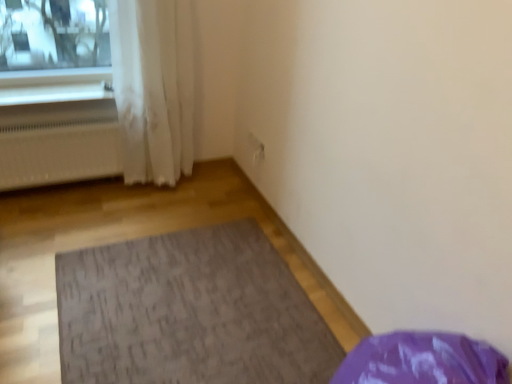
At what (x,y) coordinates should I click in order to perform the action: click on free space below textured gray mat at center (from a real-world perspective). Please return your answer as a coordinate pair (x, y). The image size is (512, 384). Looking at the image, I should click on (188, 297).